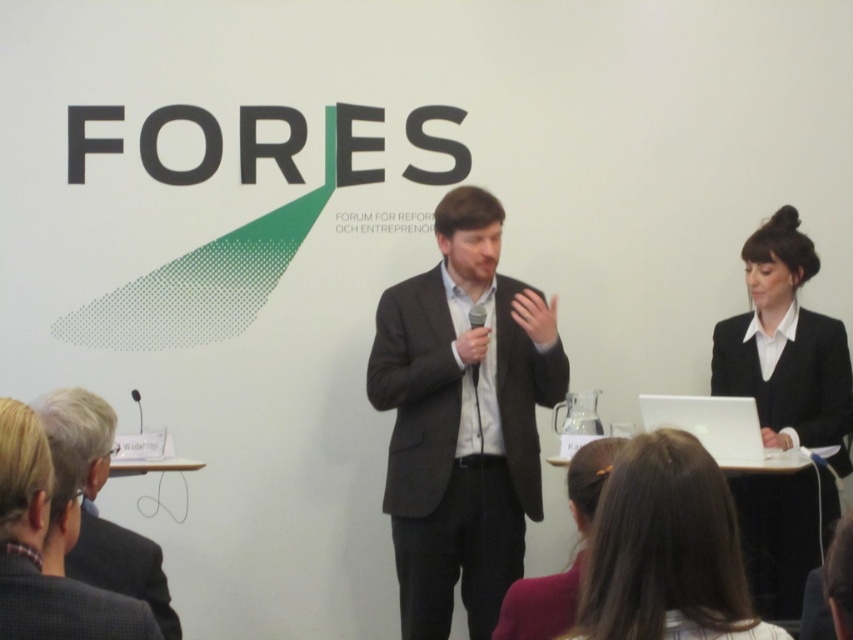
Question: Is the position of white glossy shirt at upper right more distant than that of dark gray wool suit at lower left?

Choices:
 (A) no
 (B) yes

Answer: (B)

Question: Which of the following is the farthest from the observer?

Choices:
 (A) tap(393, 474)
 (B) tap(692, 584)

Answer: (A)

Question: Estimate the real-world distances between objects in this image. Which object is closer to the gray fabric suit at lower left?

Choices:
 (A) dark gray suit at lower left
 (B) dark gray wool suit at lower left
 (C) dark gray suit at center
 (D) white glossy shirt at upper right

Answer: (A)

Question: Does dark gray suit at center lie in front of brown hair at center?

Choices:
 (A) no
 (B) yes

Answer: (A)

Question: Which point is farther to the camera?

Choices:
 (A) (560, 627)
 (B) (749, 529)

Answer: (B)

Question: Does dark gray suit at center have a smaller size compared to dark gray suit at lower left?

Choices:
 (A) yes
 (B) no

Answer: (B)